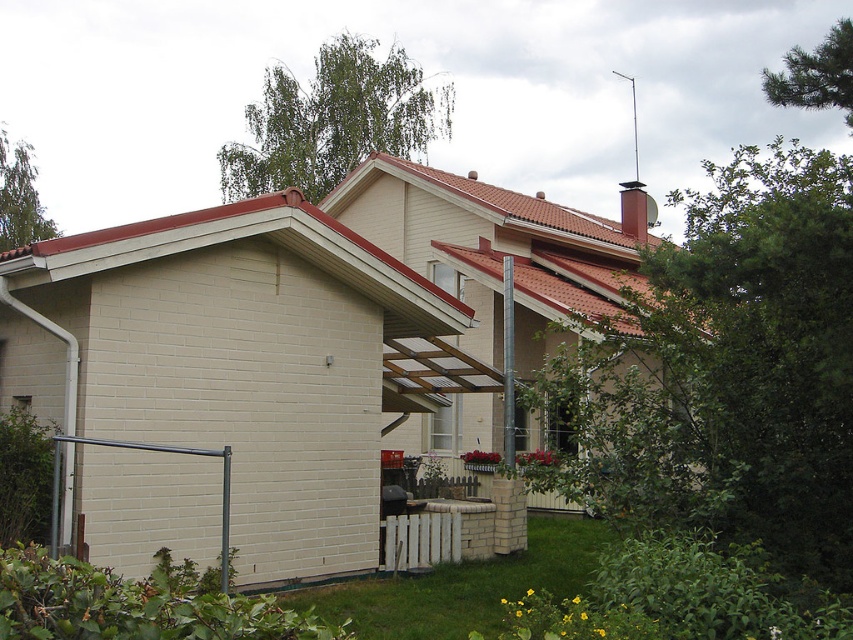
How much distance is there between white wooden fence at lower center and metallic gray rail at lower left?

white wooden fence at lower center and metallic gray rail at lower left are 3.00 meters apart.

Is white wooden fence at lower center to the left of metallic gray rail at lower left from the viewer's perspective?

Incorrect, white wooden fence at lower center is not on the left side of metallic gray rail at lower left.

Does point (383, 544) lie in front of point (57, 461)?

No, (383, 544) is further to viewer.

Locate an element on the screen. The height and width of the screenshot is (640, 853). white wooden fence at lower center is located at coordinates (421, 540).